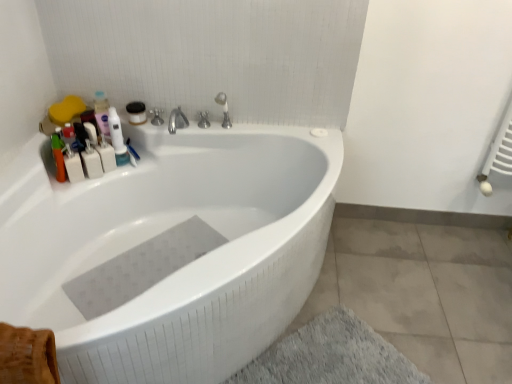
Where is `free spot to the left of polished chrome faucet at upper center, placed as the first tap when sorted from left to right`? free spot to the left of polished chrome faucet at upper center, placed as the first tap when sorted from left to right is located at coordinates (177, 123).